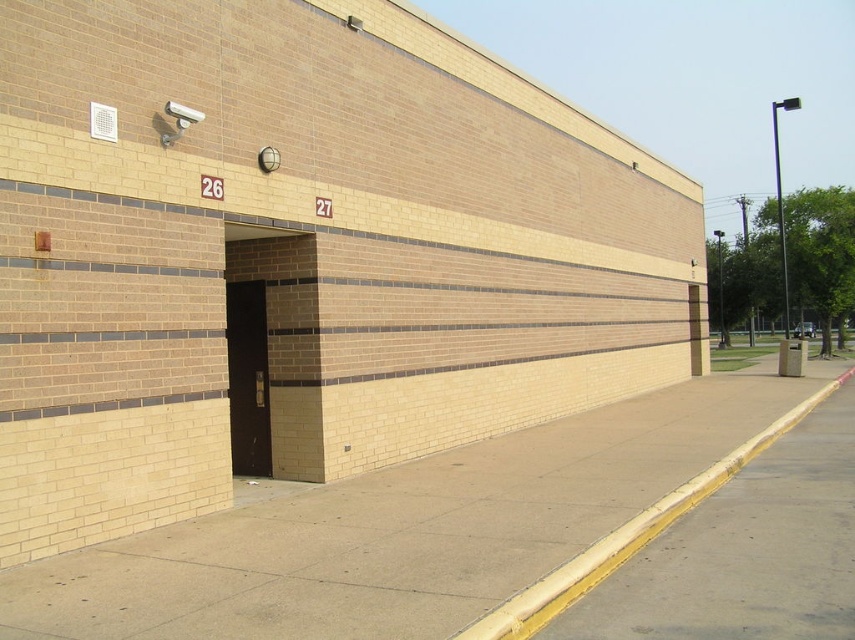
Question: Is gray concrete sidewalk at lower right above dark brown wood door at center?

Choices:
 (A) yes
 (B) no

Answer: (B)

Question: Is concrete at center above gray concrete sidewalk at lower right?

Choices:
 (A) no
 (B) yes

Answer: (B)

Question: Among these objects, which one is nearest to the camera?

Choices:
 (A) gray concrete sidewalk at lower right
 (B) dark brown wood door at center
 (C) concrete at center
 (D) black metal door at center

Answer: (C)

Question: Observing the image, what is the correct spatial positioning of concrete at center in reference to dark brown wood door at center?

Choices:
 (A) right
 (B) left

Answer: (A)

Question: Which object is positioned farthest from the concrete at center?

Choices:
 (A) dark brown wood door at center
 (B) gray concrete sidewalk at lower right

Answer: (A)

Question: Which object is farther from the camera taking this photo?

Choices:
 (A) concrete at center
 (B) gray concrete sidewalk at lower right
 (C) dark brown wood door at center
 (D) black metal door at center

Answer: (C)